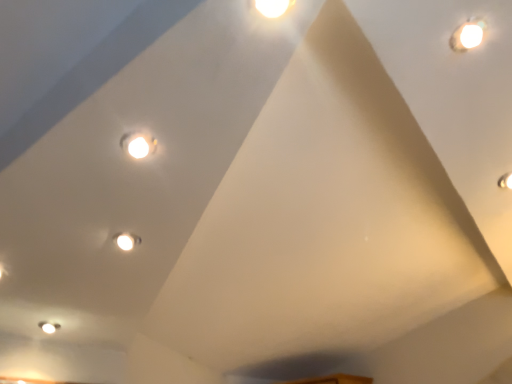
Question: Is matte white light at upper right, which is counted as the 1th light, starting from the right, outside of white glossy droplight at upper right?

Choices:
 (A) no
 (B) yes

Answer: (B)

Question: Is matte white light at upper right, the 2th light positioned from the top, thinner than white glossy droplight at upper right?

Choices:
 (A) yes
 (B) no

Answer: (B)

Question: Is matte white light at upper right, which is counted as the first light, starting from the bottom, beside white glossy droplight at upper right?

Choices:
 (A) no
 (B) yes

Answer: (A)

Question: From a real-world perspective, does matte white light at upper right, placed as the second light when sorted from left to right, stand above white glossy droplight at upper right?

Choices:
 (A) no
 (B) yes

Answer: (A)

Question: Is matte white light at upper right, the 2th light from the front, to the left of white glossy droplight at upper right from the viewer's perspective?

Choices:
 (A) no
 (B) yes

Answer: (A)

Question: Is matte white light at upper right, placed as the second light when sorted from left to right, closer to camera compared to white glossy droplight at upper right?

Choices:
 (A) yes
 (B) no

Answer: (B)

Question: Considering the relative sizes of matte white light at upper right, the 2th light from the front, and matte white light at upper center, arranged as the 1th light when viewed from the top, in the image provided, is matte white light at upper right, the 2th light from the front, taller than matte white light at upper center, arranged as the 1th light when viewed from the top,?

Choices:
 (A) yes
 (B) no

Answer: (A)

Question: From a real-world perspective, is matte white light at upper right, placed as the second light when sorted from left to right, beneath matte white light at upper center, the 2th light when ordered from right to left?

Choices:
 (A) no
 (B) yes

Answer: (A)

Question: From a real-world perspective, is matte white light at upper right, the 2th light from the front, physically above matte white light at upper center, arranged as the 1th light when viewed from the top?

Choices:
 (A) no
 (B) yes

Answer: (B)

Question: Can matte white light at upper center, the 2th light when ordered from right to left, be found inside matte white light at upper right, which is counted as the first light, starting from the bottom?

Choices:
 (A) no
 (B) yes

Answer: (A)

Question: Is matte white light at upper right, which is counted as the first light, starting from the bottom, further to the viewer compared to matte white light at upper center, which is the first light in left-to-right order?

Choices:
 (A) no
 (B) yes

Answer: (B)

Question: Does matte white light at upper right, the 2th light positioned from the top, appear on the right side of matte white light at upper center, which is the first light in left-to-right order?

Choices:
 (A) no
 (B) yes

Answer: (B)

Question: Are white glossy droplight at upper right and matte white light at upper right, the 2th light positioned from the top, far apart?

Choices:
 (A) no
 (B) yes

Answer: (A)